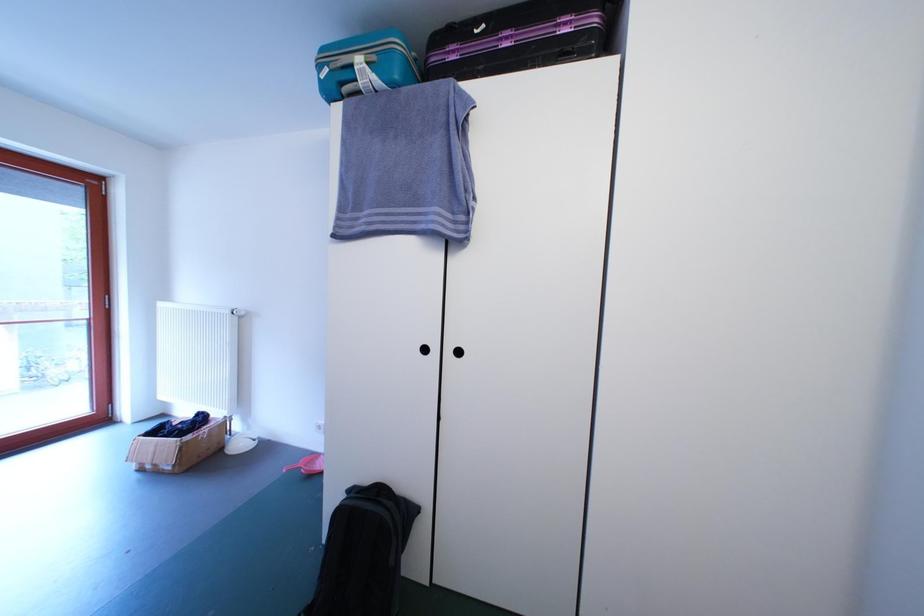
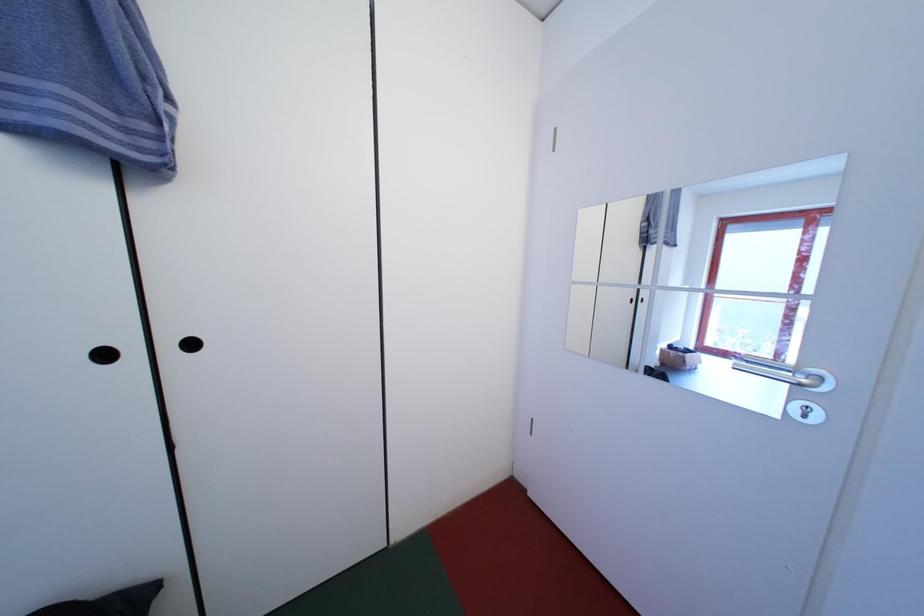
Question: The camera is either moving clockwise (left) or counter-clockwise (right) around the object. The first image is from the beginning of the video and the second image is from the end. Is the camera moving left or right when shooting the video?

Choices:
 (A) Left
 (B) Right

Answer: (A)